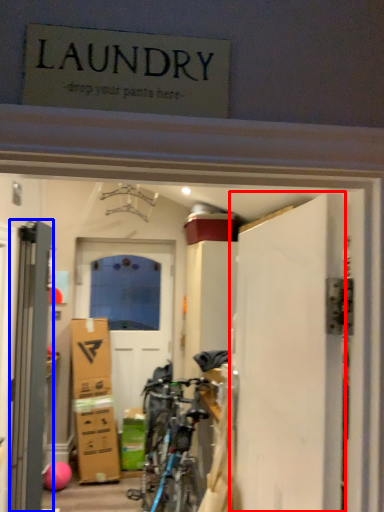
Question: Which object appears closest to the camera in this image, door (highlighted by a red box) or door (highlighted by a blue box)?

Choices:
 (A) door
 (B) door

Answer: (A)